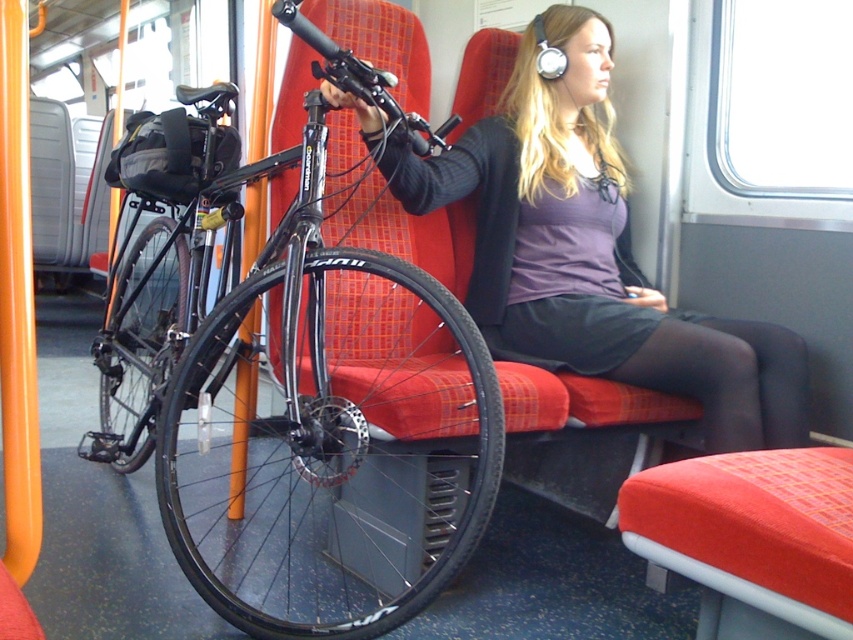
Who is higher up, shiny black bicycle at left or matte black jacket at center?

Positioned higher is matte black jacket at center.

Which of these two, shiny black bicycle at left or matte black jacket at center, stands taller?

shiny black bicycle at left is taller.

Does point (187, 316) come farther from viewer compared to point (791, 429)?

Yes.

Find the location of `shiny black bicycle at left`. shiny black bicycle at left is located at coordinates (287, 392).